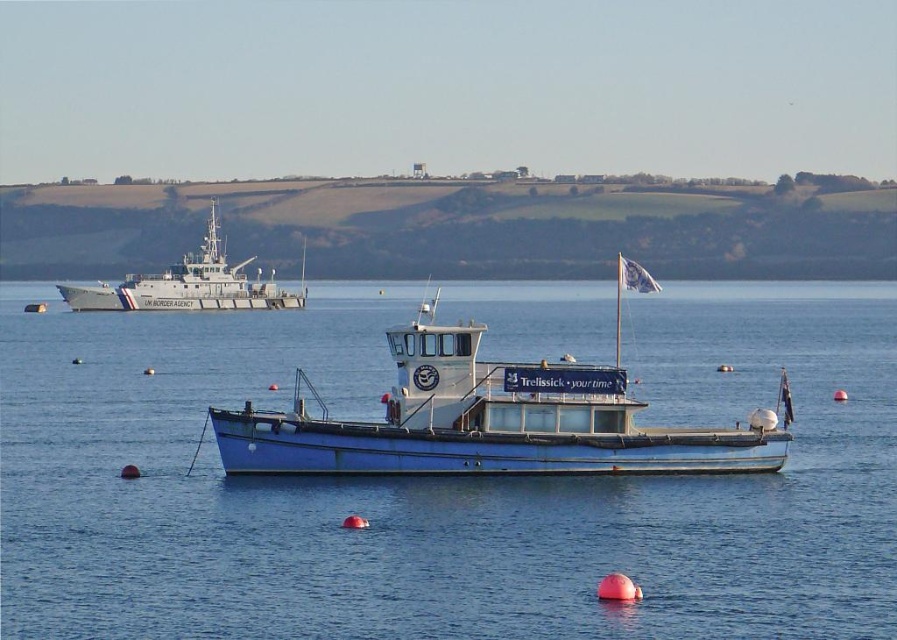
From the picture: You are standing on the deck of the smaller blue and white boat with the cabin and want to reach the point marked at coordinates (617, 481). Given that your boat is anchored and the water is calm, can you safely swim to that point without needing to swim more than 45 meters?

The point at coordinates (617, 481) is 44.90 meters away from the viewer. Since this distance is just under 45 meters, you can safely swim to that point without exceeding the 45 meter limit.

Looking at this image, you are a sailor trying to navigate between the two boats in the coastal scene. The blue metallic boat at center is represented by point (x=441, y=483). Can you determine the direction you should head to reach the larger vessel marked with UK Border Agency?

The blue metallic boat at center is represented by point (x=441, y=483). The larger vessel marked with UK Border Agency is in the background, so you should head towards the background direction to reach it.